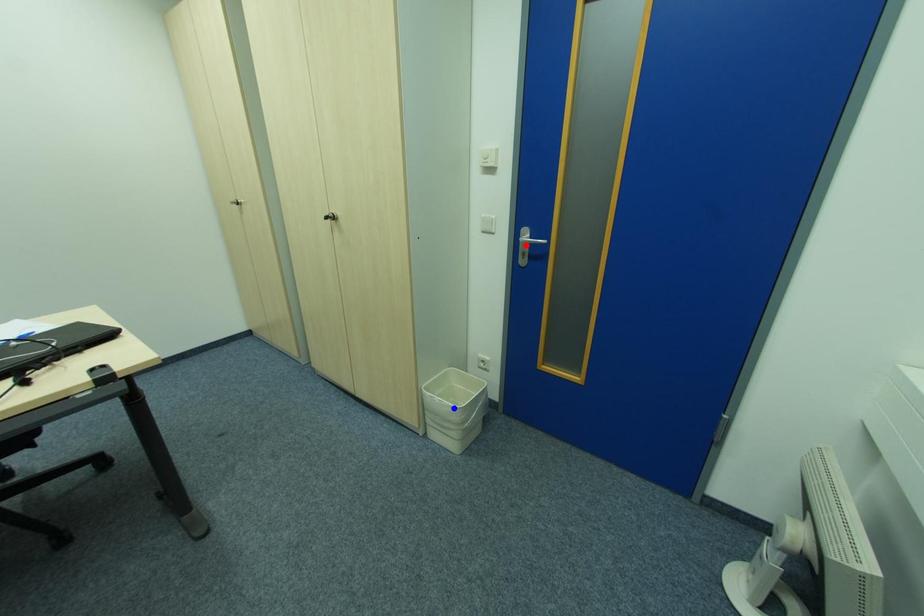
Question: Which of the two points in the image is closer to the camera?

Choices:
 (A) Blue point is closer.
 (B) Red point is closer.

Answer: (B)